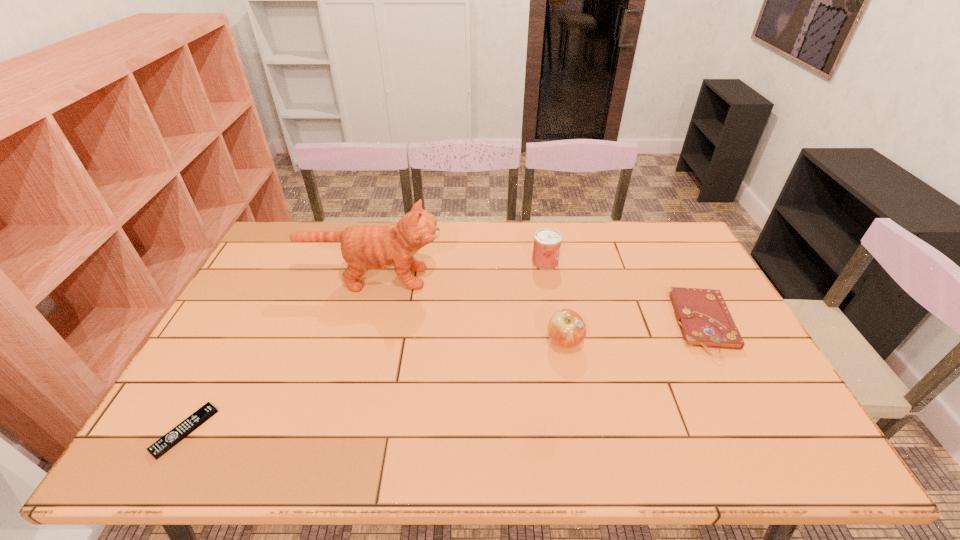
Find the location of a particular element. free region that satisfies the following two spatial constraints: 1. on the face of the tallest object; 2. on the right side of the second shortest object is located at coordinates (361, 325).